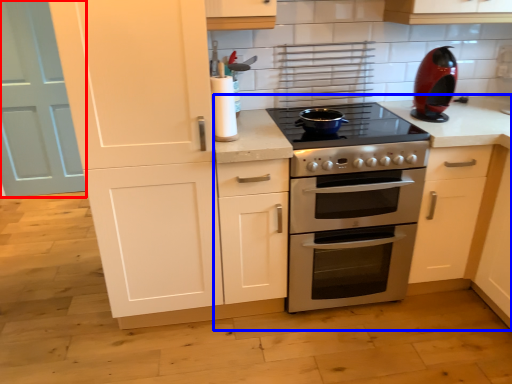
Question: Which object is further to the camera taking this photo, door (highlighted by a red box) or countertop (highlighted by a blue box)?

Choices:
 (A) door
 (B) countertop

Answer: (A)